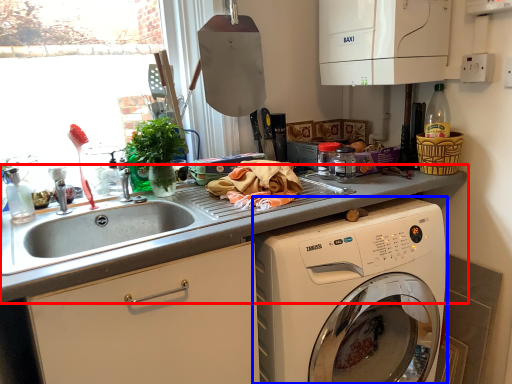
Question: Which of the following is the farthest to the observer, countertop (highlighted by a red box) or washing machine (highlighted by a blue box)?

Choices:
 (A) countertop
 (B) washing machine

Answer: (B)